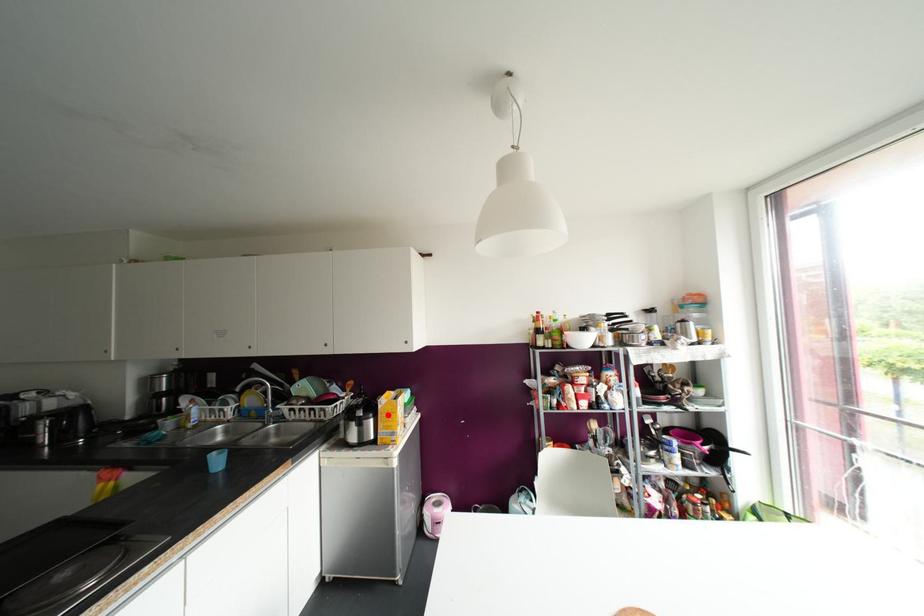
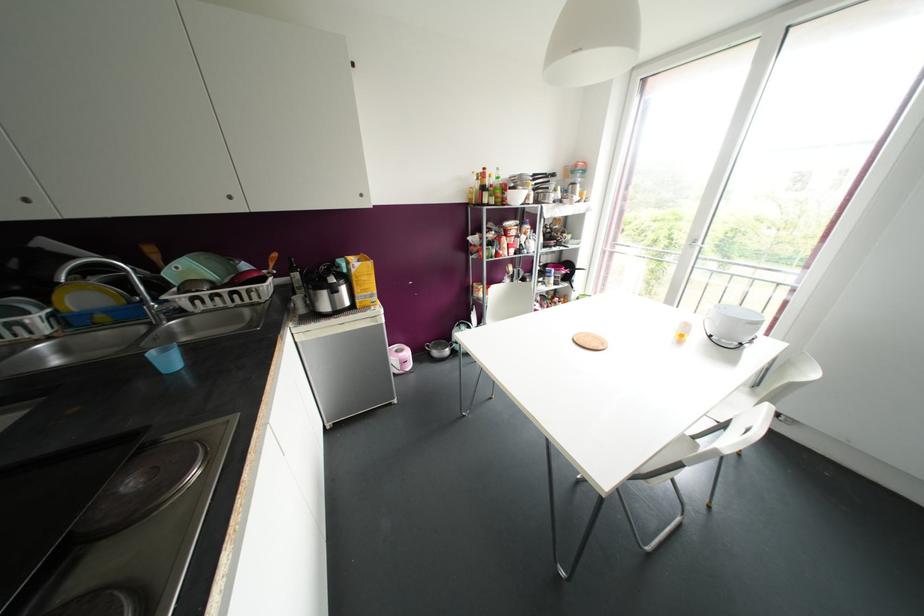
Question: I am providing you with two images of the same scene from different viewpoints. Given a red point in image1, look at the same physical point in image2. Is it:

Choices:
 (A) Closer to the viewpoint
 (B) Farther from the viewpoint

Answer: (A)